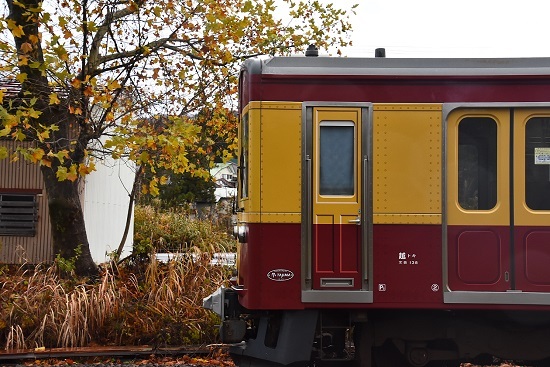
At what (x,y) coordinates should I click in order to perform the action: click on door. Please return your answer as a coordinate pair (x, y). Image resolution: width=550 pixels, height=367 pixels. Looking at the image, I should click on (322, 186).